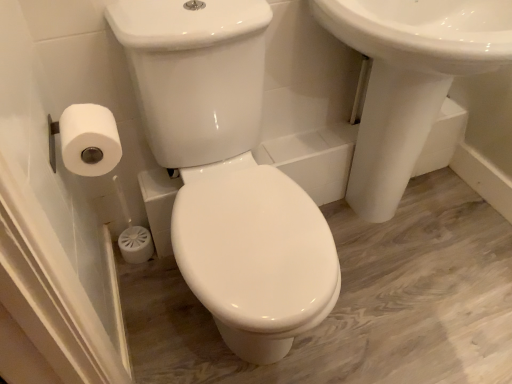
Question: Based on their sizes in the image, would you say white matte toilet paper at left is bigger or smaller than white glossy toilet at center?

Choices:
 (A) small
 (B) big

Answer: (A)

Question: Considering their positions, is white matte toilet paper at left located in front of or behind white glossy toilet at center?

Choices:
 (A) front
 (B) behind

Answer: (B)

Question: Which of these objects is positioned farthest from the white matte toilet paper at left?

Choices:
 (A) white glossy sink at upper right
 (B) white glossy toilet at center

Answer: (A)

Question: Estimate the real-world distances between objects in this image. Which object is closer to the white matte toilet paper at left?

Choices:
 (A) white glossy sink at upper right
 (B) white glossy toilet at center

Answer: (B)